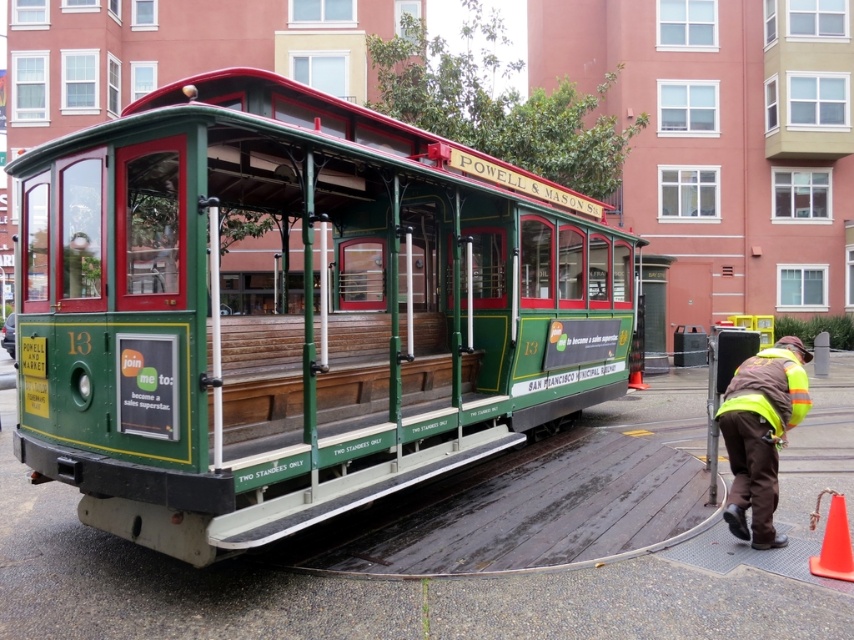
Question: Can you confirm if green polished wood cable car at center is wider than orange plastic cone at lower right?

Choices:
 (A) yes
 (B) no

Answer: (A)

Question: Which point is closer to the camera taking this photo?

Choices:
 (A) (732, 400)
 (B) (840, 548)

Answer: (B)

Question: Considering the relative positions of high-visibility reflective vest at lower right and high-visibility fabric safety vest at lower right in the image provided, where is high-visibility reflective vest at lower right located with respect to high-visibility fabric safety vest at lower right?

Choices:
 (A) below
 (B) above

Answer: (A)

Question: Estimate the real-world distances between objects in this image. Which object is farther from the orange plastic cone at lower right?

Choices:
 (A) high-visibility fabric safety vest at lower right
 (B) high-visibility reflective vest at lower right
 (C) green polished wood cable car at center

Answer: (C)

Question: Which of the following is the farthest from the observer?

Choices:
 (A) (816, 522)
 (B) (347, 356)
 (C) (768, 522)
 (D) (791, 416)

Answer: (B)

Question: Where is green polished wood cable car at center located in relation to orange plastic cone at lower right in the image?

Choices:
 (A) right
 (B) left

Answer: (B)